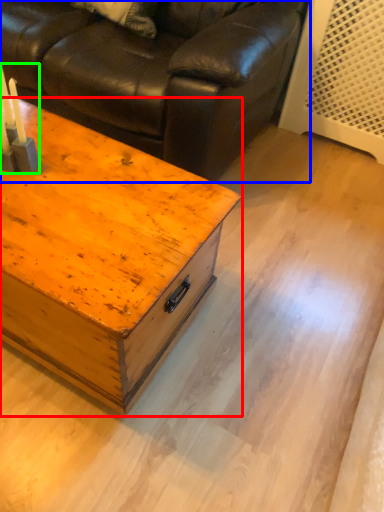
Question: Which object is positioned farthest from table (highlighted by a red box)? Select from studio couch (highlighted by a blue box) and candle holder (highlighted by a green box).

Choices:
 (A) studio couch
 (B) candle holder

Answer: (A)